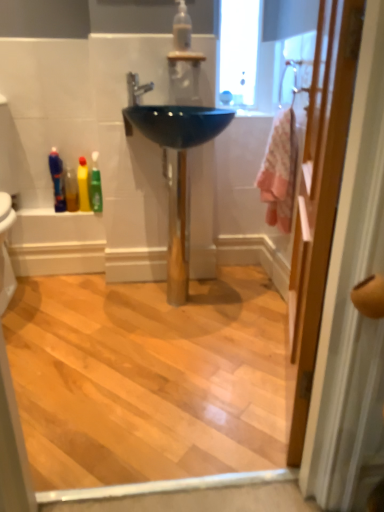
What do you see at coordinates (71, 190) in the screenshot?
I see `translucent plastic mouthwash at left, the 1th mouthwash ordered from the bottom` at bounding box center [71, 190].

In order to face pink fabric at right, should I rotate leftwards or rightwards?

To face it directly, rotate right by 13.858 degrees.

Describe the element at coordinates (182, 28) in the screenshot. I see `transparent plastic mouthwash at upper center, the 2th mouthwash positioned from the left` at that location.

The height and width of the screenshot is (512, 384). What do you see at coordinates (95, 186) in the screenshot?
I see `green plastic toothpaste tube at left, marked as the first toiletry in a right-to-left arrangement` at bounding box center [95, 186].

What is the approximate width of matte white shower at upper right?

2.67 inches.

Measure the distance between point [61,177] and camera.

Point [61,177] is 2.09 meters from camera.

Identify the location of silver metallic faucet at center. (136, 88).

Who is bigger, yellow matte bottle at lower left, placed as the second toiletry when sorted from left to right, or green plastic toothpaste tube at left, marked as the first toiletry in a right-to-left arrangement?

green plastic toothpaste tube at left, marked as the first toiletry in a right-to-left arrangement.

In the scene shown: Is yellow matte bottle at lower left, which ranks as the second toiletry in right-to-left order, aimed at green plastic toothpaste tube at left, positioned as the 3th toiletry in left-to-right order?

No, yellow matte bottle at lower left, which ranks as the second toiletry in right-to-left order, is not facing towards green plastic toothpaste tube at left, positioned as the 3th toiletry in left-to-right order.

Is yellow matte bottle at lower left, which ranks as the second toiletry in right-to-left order, shorter than green plastic toothpaste tube at left, marked as the first toiletry in a right-to-left arrangement?

Indeed, yellow matte bottle at lower left, which ranks as the second toiletry in right-to-left order, has a lesser height compared to green plastic toothpaste tube at left, marked as the first toiletry in a right-to-left arrangement.

Starting from the green plastic toothpaste tube at left, positioned as the 3th toiletry in left-to-right order, which toiletry is the 1st one to the left? Please provide its 2D coordinates.

[(83, 185)]

Considering the points (58, 208) and (139, 99), which point is in front, point (58, 208) or point (139, 99)?

Positioned in front is point (139, 99).

Looking at their sizes, would you say translucent plastic bottles at lower left, the third toiletry in the right-to-left sequence, is wider or thinner than silver metallic faucet at center?

In the image, translucent plastic bottles at lower left, the third toiletry in the right-to-left sequence, appears to be more narrow than silver metallic faucet at center.

From a real-world perspective, which object rests below the other?

translucent plastic bottles at lower left, the third toiletry in the right-to-left sequence, from a real-world perspective.

Is translucent plastic bottles at lower left, which appears as the 1th toiletry when viewed from the left, placed right next to silver metallic faucet at center?

No, translucent plastic bottles at lower left, which appears as the 1th toiletry when viewed from the left, is not in contact with silver metallic faucet at center.

Considering the positions of objects yellow matte bottle at lower left, which ranks as the second toiletry in right-to-left order, and pink fabric bath towel at right in the image provided, who is more to the right, yellow matte bottle at lower left, which ranks as the second toiletry in right-to-left order, or pink fabric bath towel at right?

pink fabric bath towel at right is more to the right.

Is point (80, 204) closer to viewer compared to point (282, 141)?

No, (80, 204) is behind (282, 141).

Can you confirm if yellow matte bottle at lower left, which ranks as the second toiletry in right-to-left order, is taller than pink fabric bath towel at right?

No.

At what (x,y) coordinates should I click in order to perform the action: click on toiletry below the pink fabric bath towel at right (from the image's perspective). Please return your answer as a coordinate pair (x, y). The image size is (384, 512). Looking at the image, I should click on (83, 185).

Which is closer, (x=297, y=90) or (x=82, y=156)?

Point (x=297, y=90) appears to be closer to the viewer than point (x=82, y=156).

From the image's perspective, which one is positioned higher, matte white shower at upper right or yellow matte bottle at lower left, placed as the second toiletry when sorted from left to right?

matte white shower at upper right, from the image's perspective.

Could you measure the distance between matte white shower at upper right and yellow matte bottle at lower left, placed as the second toiletry when sorted from left to right?

A distance of 98.57 centimeters exists between matte white shower at upper right and yellow matte bottle at lower left, placed as the second toiletry when sorted from left to right.

Considering the sizes of objects matte white shower at upper right and yellow matte bottle at lower left, which ranks as the second toiletry in right-to-left order, in the image provided, who is wider, matte white shower at upper right or yellow matte bottle at lower left, which ranks as the second toiletry in right-to-left order,?

yellow matte bottle at lower left, which ranks as the second toiletry in right-to-left order, is wider.

Does translucent plastic bottles at lower left, which appears as the 1th toiletry when viewed from the left, have a greater height compared to translucent plastic mouthwash at left, which is the second mouthwash in right-to-left order?

Indeed, translucent plastic bottles at lower left, which appears as the 1th toiletry when viewed from the left, has a greater height compared to translucent plastic mouthwash at left, which is the second mouthwash in right-to-left order.

From the image's perspective, is translucent plastic bottles at lower left, which appears as the 1th toiletry when viewed from the left, located beneath translucent plastic mouthwash at left, which is the second mouthwash in right-to-left order?

Actually, translucent plastic bottles at lower left, which appears as the 1th toiletry when viewed from the left, appears above translucent plastic mouthwash at left, which is the second mouthwash in right-to-left order, in the image.

Considering the relative positions of translucent plastic bottles at lower left, the third toiletry in the right-to-left sequence, and translucent plastic mouthwash at left, acting as the second mouthwash starting from the front, in the image provided, is translucent plastic bottles at lower left, the third toiletry in the right-to-left sequence, to the left or to the right of translucent plastic mouthwash at left, acting as the second mouthwash starting from the front,?

From the image, it's evident that translucent plastic bottles at lower left, the third toiletry in the right-to-left sequence, is to the left of translucent plastic mouthwash at left, acting as the second mouthwash starting from the front.

From a real-world perspective, is translucent plastic bottles at lower left, the third toiletry in the right-to-left sequence, under translucent plastic mouthwash at left, the first mouthwash positioned from the back?

Incorrect, from a real-world perspective, translucent plastic bottles at lower left, the third toiletry in the right-to-left sequence, is higher than translucent plastic mouthwash at left, the first mouthwash positioned from the back.

From the picture: From a real-world perspective, is transparent plastic mouthwash at upper center, the 1th mouthwash viewed from the front, beneath silver metallic faucet at center?

Incorrect, from a real-world perspective, transparent plastic mouthwash at upper center, the 1th mouthwash viewed from the front, is higher than silver metallic faucet at center.

Is transparent plastic mouthwash at upper center, arranged as the first mouthwash when viewed from the top, thinner than silver metallic faucet at center?

Yes.

Does transparent plastic mouthwash at upper center, which is counted as the second mouthwash, starting from the bottom, turn towards silver metallic faucet at center?

No, transparent plastic mouthwash at upper center, which is counted as the second mouthwash, starting from the bottom, is not aimed at silver metallic faucet at center.

Can you see transparent plastic mouthwash at upper center, which is counted as the second mouthwash, starting from the bottom, touching silver metallic faucet at center?

There is a gap between transparent plastic mouthwash at upper center, which is counted as the second mouthwash, starting from the bottom, and silver metallic faucet at center.

Between matte white shower at upper right and green plastic toothpaste tube at left, positioned as the 3th toiletry in left-to-right order, which one has larger size?

With larger size is matte white shower at upper right.

In the image, is matte white shower at upper right positioned in front of or behind green plastic toothpaste tube at left, marked as the first toiletry in a right-to-left arrangement?

matte white shower at upper right is positioned closer to the viewer than green plastic toothpaste tube at left, marked as the first toiletry in a right-to-left arrangement.

From their relative heights in the image, would you say matte white shower at upper right is taller or shorter than green plastic toothpaste tube at left, positioned as the 3th toiletry in left-to-right order?

Clearly, matte white shower at upper right is shorter compared to green plastic toothpaste tube at left, positioned as the 3th toiletry in left-to-right order.

Where is `the 2nd toiletry below when counting from the green plastic toothpaste tube at left, positioned as the 3th toiletry in left-to-right order (from the image's perspective)`? the 2nd toiletry below when counting from the green plastic toothpaste tube at left, positioned as the 3th toiletry in left-to-right order (from the image's perspective) is located at coordinates (83, 185).

Find the location of a particular element. tap above the translucent plastic bottles at lower left, the third toiletry in the right-to-left sequence (from a real-world perspective) is located at coordinates (136, 88).

Considering their positions, is green plastic toothpaste tube at left, marked as the first toiletry in a right-to-left arrangement, positioned closer to translucent plastic mouthwash at left, the 1th mouthwash ordered from the bottom, than silver metallic faucet at center?

Among the two, green plastic toothpaste tube at left, marked as the first toiletry in a right-to-left arrangement, is located nearer to translucent plastic mouthwash at left, the 1th mouthwash ordered from the bottom.

Looking at this image, from the image, which object appears to be nearer to glossy ceramic sink at center, yellow matte bottle at lower left, which ranks as the second toiletry in right-to-left order, or translucent plastic bottles at lower left, which appears as the 1th toiletry when viewed from the left?

yellow matte bottle at lower left, which ranks as the second toiletry in right-to-left order, is closer to glossy ceramic sink at center.

Which object lies nearer to the anchor point pink fabric at right, glossy ceramic sink at center or matte white shower at upper right?

Among the two, glossy ceramic sink at center is located nearer to pink fabric at right.

Considering their positions, is pink fabric bath towel at right positioned closer to matte white shower at upper right than glossy ceramic sink at center?

pink fabric bath towel at right.

Looking at the image, which one is located further to pink fabric at right, glossy ceramic sink at center or yellow matte bottle at lower left, which ranks as the second toiletry in right-to-left order?

Among the two, yellow matte bottle at lower left, which ranks as the second toiletry in right-to-left order, is located further to pink fabric at right.

Considering their positions, is translucent plastic mouthwash at left, which is the second mouthwash in right-to-left order, positioned closer to translucent plastic bottles at lower left, which appears as the 1th toiletry when viewed from the left, than pink fabric bath towel at right?

translucent plastic mouthwash at left, which is the second mouthwash in right-to-left order, is closer to translucent plastic bottles at lower left, which appears as the 1th toiletry when viewed from the left.

Looking at the image, which one is located further to glossy ceramic sink at center, transparent plastic mouthwash at upper center, the 1th mouthwash viewed from the front, or matte white shower at upper right?

matte white shower at upper right is positioned further to the anchor glossy ceramic sink at center.

From the picture: From the image, which object appears to be nearer to translucent plastic mouthwash at left, which is the second mouthwash in right-to-left order, yellow matte bottle at lower left, placed as the second toiletry when sorted from left to right, or matte white shower at upper right?

yellow matte bottle at lower left, placed as the second toiletry when sorted from left to right, lies closer to translucent plastic mouthwash at left, which is the second mouthwash in right-to-left order, than the other object.

This screenshot has height=512, width=384. Find the location of `mouthwash positioned between pink fabric at right and translucent plastic mouthwash at left, which ranks as the first mouthwash in left-to-right order, from near to far`. mouthwash positioned between pink fabric at right and translucent plastic mouthwash at left, which ranks as the first mouthwash in left-to-right order, from near to far is located at coordinates (182, 28).

At what (x,y) coordinates should I click in order to perform the action: click on toiletry between translucent plastic mouthwash at left, the first mouthwash positioned from the back, and green plastic toothpaste tube at left, marked as the first toiletry in a right-to-left arrangement. Please return your answer as a coordinate pair (x, y). Image resolution: width=384 pixels, height=512 pixels. Looking at the image, I should click on (83, 185).

Image resolution: width=384 pixels, height=512 pixels. What are the coordinates of `tap situated between green plastic toothpaste tube at left, positioned as the 3th toiletry in left-to-right order, and pink fabric bath towel at right from left to right` in the screenshot? It's located at (136, 88).

Where is `tap between green plastic toothpaste tube at left, positioned as the 3th toiletry in left-to-right order, and matte white shower at upper right`? The height and width of the screenshot is (512, 384). tap between green plastic toothpaste tube at left, positioned as the 3th toiletry in left-to-right order, and matte white shower at upper right is located at coordinates (136, 88).